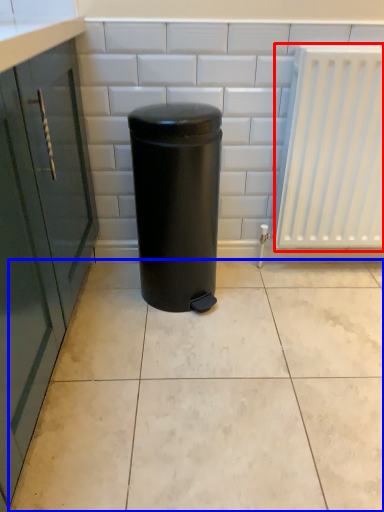
Question: Which object is further to the camera taking this photo, radiator (highlighted by a red box) or ceramic tile (highlighted by a blue box)?

Choices:
 (A) radiator
 (B) ceramic tile

Answer: (A)